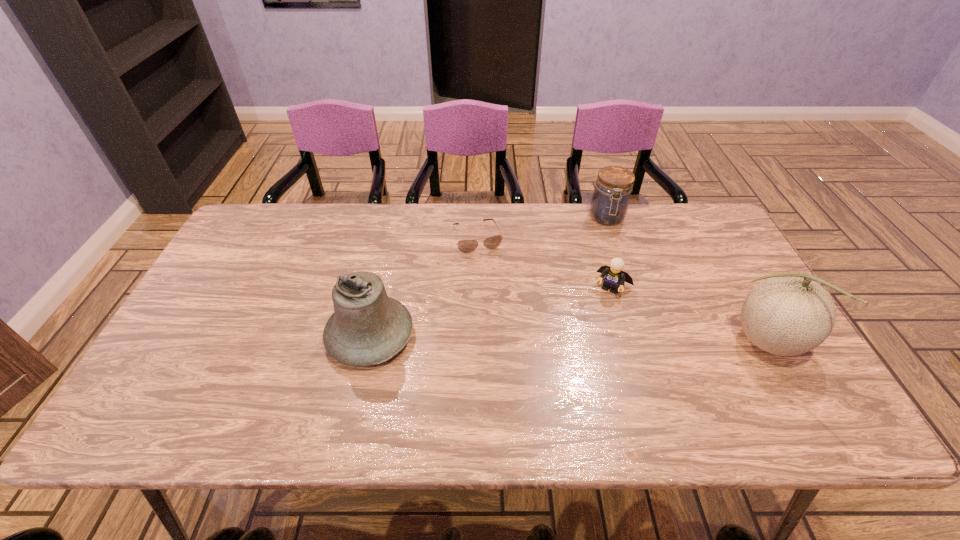
This screenshot has height=540, width=960. In the image, there is a desktop. In order to click on free space at the far right corner in this screenshot , I will do `click(678, 207)`.

Find the location of a particular element. This screenshot has width=960, height=540. empty location between the third farthest object and the leftmost object is located at coordinates (492, 311).

At what (x,y) coordinates should I click in order to perform the action: click on empty space that is in between the third nearest object and the jar. Please return your answer as a coordinate pair (x, y). Looking at the image, I should click on (610, 252).

Identify the location of vacant area between the bell and the jar. (489, 276).

Identify the location of vacant area that lies between the third nearest object and the jar. Image resolution: width=960 pixels, height=540 pixels. (610, 252).

Find the location of a particular element. empty space between the sunglasses and the Lego is located at coordinates (545, 262).

The height and width of the screenshot is (540, 960). I want to click on free space between the second tallest object and the rightmost object, so [568, 339].

This screenshot has width=960, height=540. What are the coordinates of `vacant space in between the third farthest object and the shortest object` in the screenshot? It's located at (545, 262).

Locate which object is the closest to the Lego. Please provide its 2D coordinates. Your answer should be formatted as a tuple, i.e. [(x, y)], where the tuple contains the x and y coordinates of a point satisfying the conditions above.

[(788, 314)]

Where is `object that is the third closest to the jar`? The height and width of the screenshot is (540, 960). object that is the third closest to the jar is located at coordinates (788, 314).